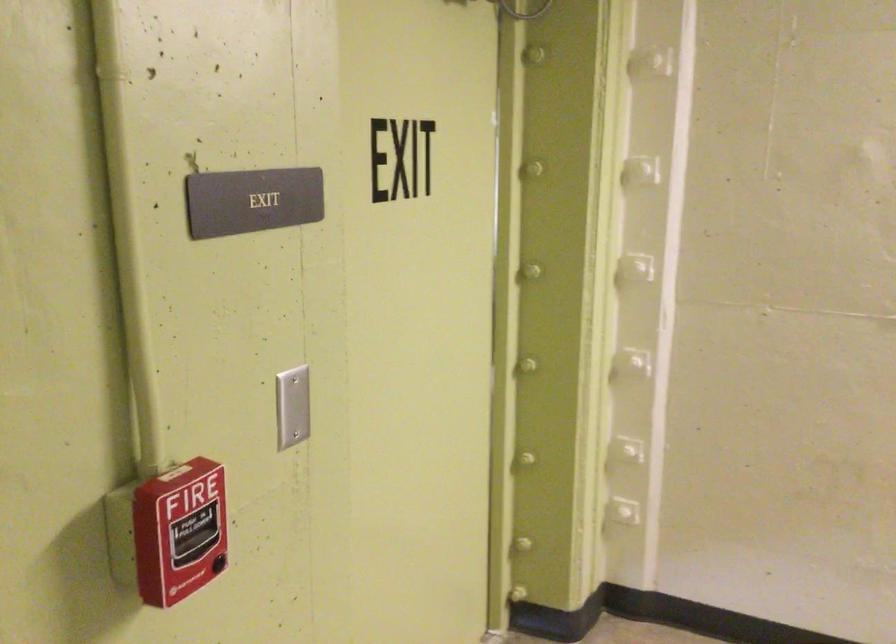
You are a GUI agent. You are given a task and a screenshot of the screen. Output one action in this format:
    pyautogui.click(x=<x>, y=<y>)
    Task: Click on the red fire alarm handle
    
    Given the screenshot: What is the action you would take?
    pyautogui.click(x=179, y=532)